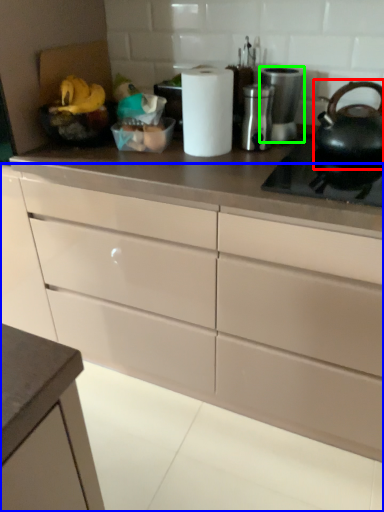
Question: Which is farther away from tea pot (highlighted by a red box)? cabinetry (highlighted by a blue box) or appliance (highlighted by a green box)?

Choices:
 (A) cabinetry
 (B) appliance

Answer: (A)